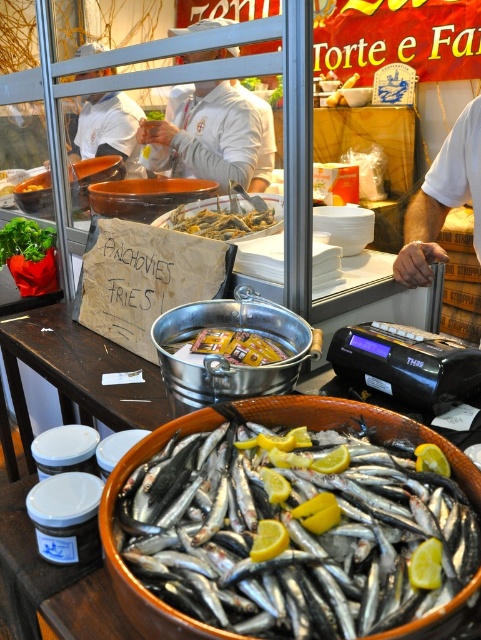
Is white cotton shirt at center shorter than shiny silver anchovies at center?

In fact, white cotton shirt at center may be taller than shiny silver anchovies at center.

Which is more to the left, white cotton shirt at center or shiny silver anchovies at center?

white cotton shirt at center

Is point (230, 177) closer to viewer compared to point (165, 224)?

That is False.

Where is `white cotton shirt at center`? This screenshot has width=481, height=640. white cotton shirt at center is located at coordinates (215, 136).

Does white cotton shirt at center have a smaller size compared to yellowish plastic packet at center?

No, white cotton shirt at center is not smaller than yellowish plastic packet at center.

Consider the image. Is white cotton shirt at center positioned before yellowish plastic packet at center?

No, white cotton shirt at center is further to the viewer.

Is point (178, 109) closer to camera compared to point (175, 355)?

No, (178, 109) is further to viewer.

The width and height of the screenshot is (481, 640). In order to click on white cotton shirt at center in this screenshot , I will do `click(215, 136)`.

Can you confirm if silver metallic fish at center is positioned below yellowish plastic packet at center?

Yes.

Is silver metallic fish at center smaller than yellowish plastic packet at center?

No, silver metallic fish at center is not smaller than yellowish plastic packet at center.

Between point (211, 545) and point (228, 355), which one is positioned behind?

The point (228, 355) is behind.

Identify the location of silver metallic fish at center. (291, 531).